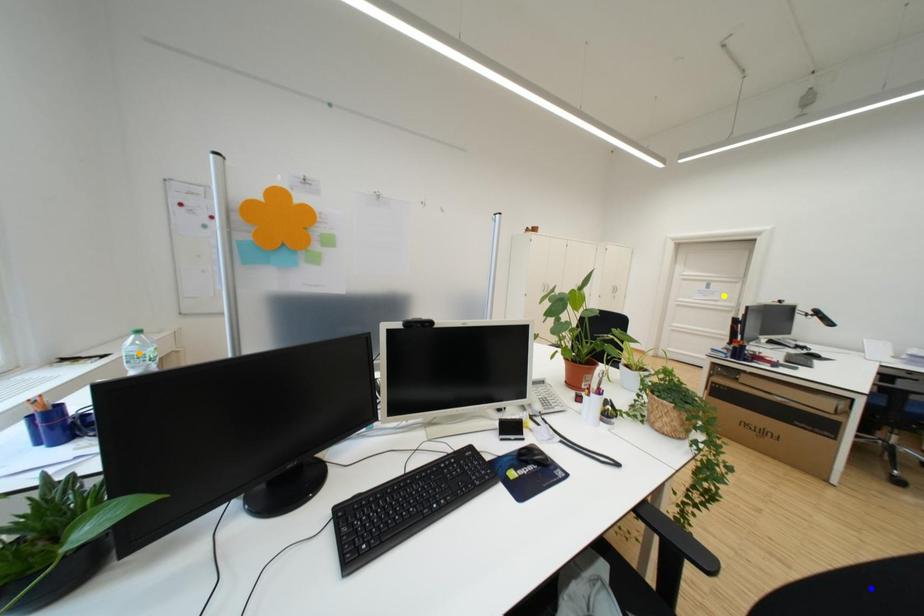
Order these from nearest to farthest:
orange point
yellow point
blue point

1. blue point
2. orange point
3. yellow point